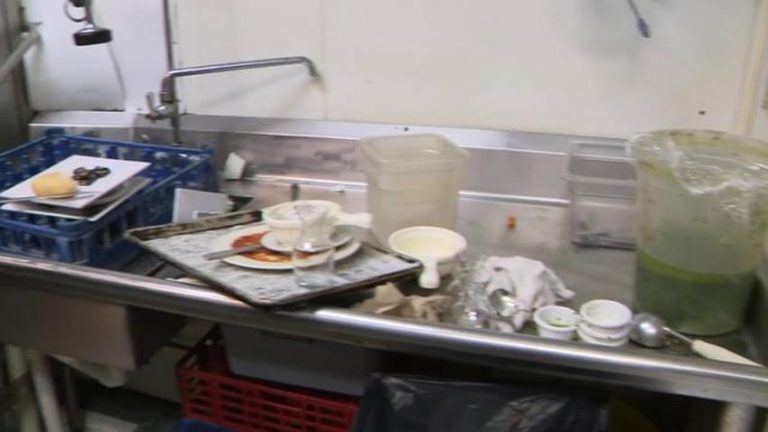
Locate an element on the screen. The image size is (768, 432). dishwasher tray is located at coordinates (176, 163).